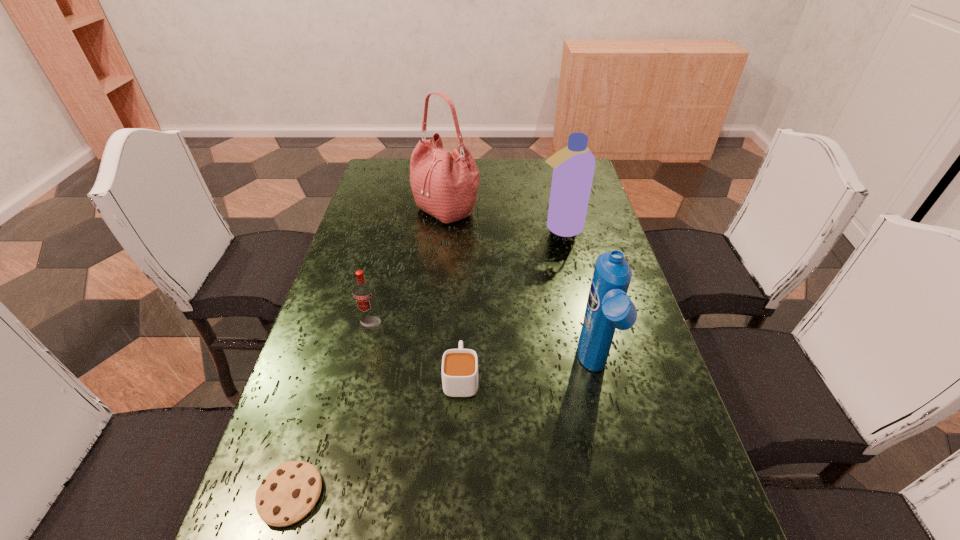
In order to click on vacant area situated 0.230m on the front of the nearer shampoo in this screenshot , I will do `click(629, 517)`.

This screenshot has width=960, height=540. I want to click on free space located on the front label of the fourth tallest object, so click(328, 498).

Find the location of a particular element. blank space located 0.250m on the side with the handle of the second shortest object is located at coordinates (465, 284).

The width and height of the screenshot is (960, 540). Identify the location of blank space located 0.060m on the side with the handle of the second shortest object. pos(463,336).

Image resolution: width=960 pixels, height=540 pixels. Find the location of `free location located 0.240m on the side with the handle of the second shortest object`. free location located 0.240m on the side with the handle of the second shortest object is located at coordinates (465, 286).

The width and height of the screenshot is (960, 540). Find the location of `vacant space located 0.200m on the back of the shortest object`. vacant space located 0.200m on the back of the shortest object is located at coordinates (326, 377).

The width and height of the screenshot is (960, 540). Identify the location of vodka located at the left edge. (363, 291).

Where is `cookie that is at the left edge`? The height and width of the screenshot is (540, 960). cookie that is at the left edge is located at coordinates (289, 492).

Locate an element on the screen. This screenshot has height=540, width=960. free location at the far edge is located at coordinates (528, 161).

Where is `vacant space at the left edge of the desktop`? This screenshot has width=960, height=540. vacant space at the left edge of the desktop is located at coordinates tap(334, 293).